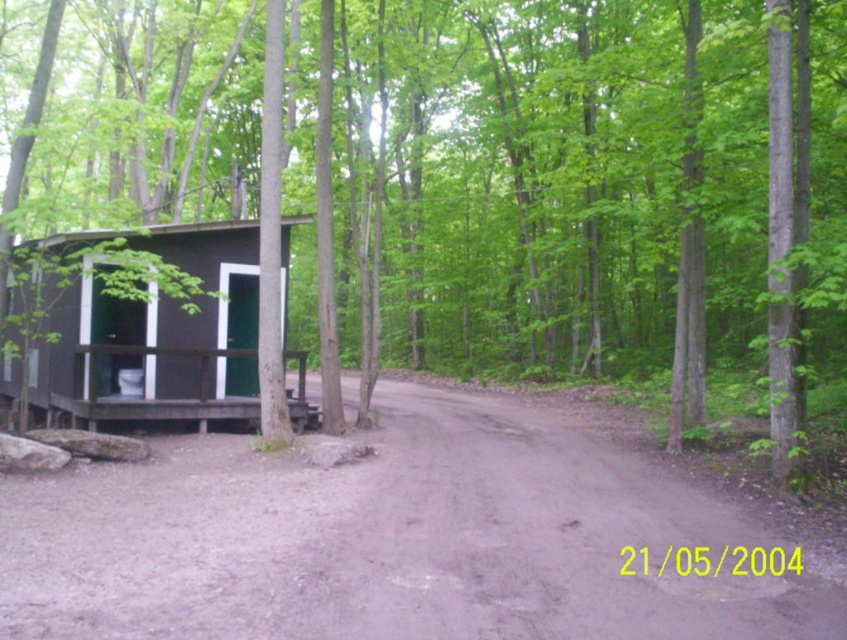
Based on the photo, you are standing at the edge of the forest and want to reach the black wood cabin at left. Which direction should you walk to get there from the brown dirt track at center?

The brown dirt track at center is closer to the viewer than the black wood cabin at left, so you should walk towards the left side of the image to reach the black wood cabin at left.

You are a hiker carrying a 2.5 meter long tent pole. You see the brown dirt track at center and the black wood cabin at left. Which path can you safely walk through with your tent pole without it getting stuck?

The brown dirt track at center is wider than the black wood cabin at left, so you can safely walk through the brown dirt track at center with your 2.5 meter long tent pole without it getting stuck.